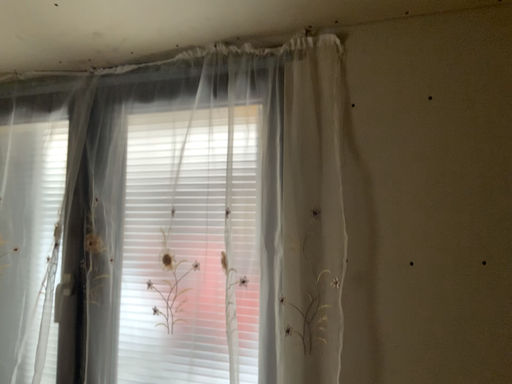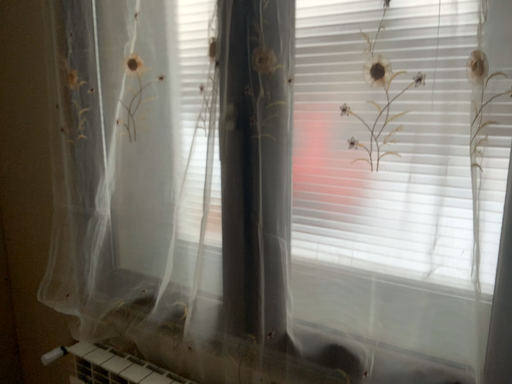
Question: How did the camera likely rotate when shooting the video?

Choices:
 (A) rotated left
 (B) rotated right

Answer: (A)